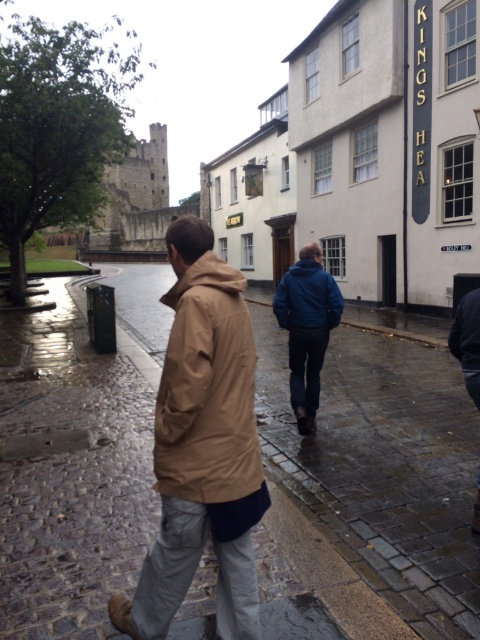
Question: Which is farther from the blue fabric jacket at center?

Choices:
 (A) tan fabric trench coat at center
 (B) tan matte jacket at center
 (C) dark blue jacket at lower right
 (D) blue matte jacket at center

Answer: (C)

Question: Can you confirm if tan fabric trench coat at center is bigger than blue fabric jacket at center?

Choices:
 (A) no
 (B) yes

Answer: (B)

Question: Is blue fabric jacket at center positioned in front of dark blue jacket at lower right?

Choices:
 (A) no
 (B) yes

Answer: (A)

Question: Estimate the real-world distances between objects in this image. Which object is closer to the blue matte jacket at center?

Choices:
 (A) tan matte jacket at center
 (B) dark blue jacket at lower right
 (C) tan fabric trench coat at center
 (D) blue fabric jacket at center

Answer: (D)

Question: Which point is closer to the camera?

Choices:
 (A) (134, 612)
 (B) (313, 308)
 (C) (478, 481)
 (D) (317, 401)

Answer: (A)

Question: Is tan fabric trench coat at center bigger than blue matte jacket at center?

Choices:
 (A) no
 (B) yes

Answer: (B)